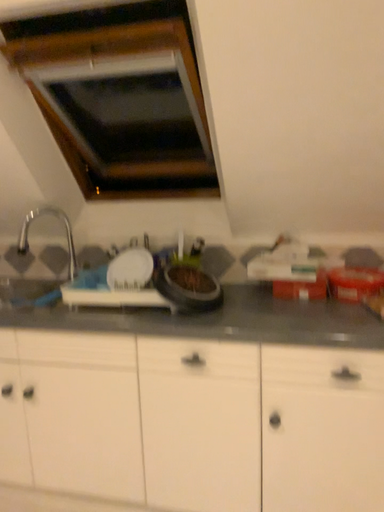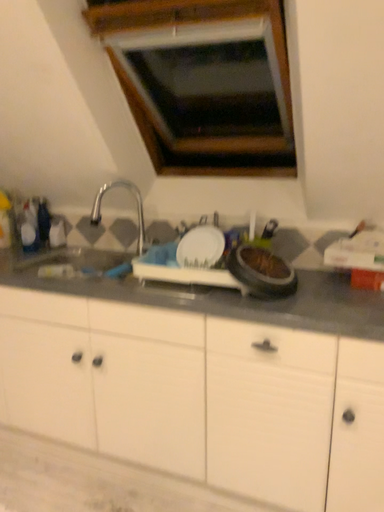
Question: How did the camera likely rotate when shooting the video?

Choices:
 (A) rotated right
 (B) rotated left

Answer: (B)